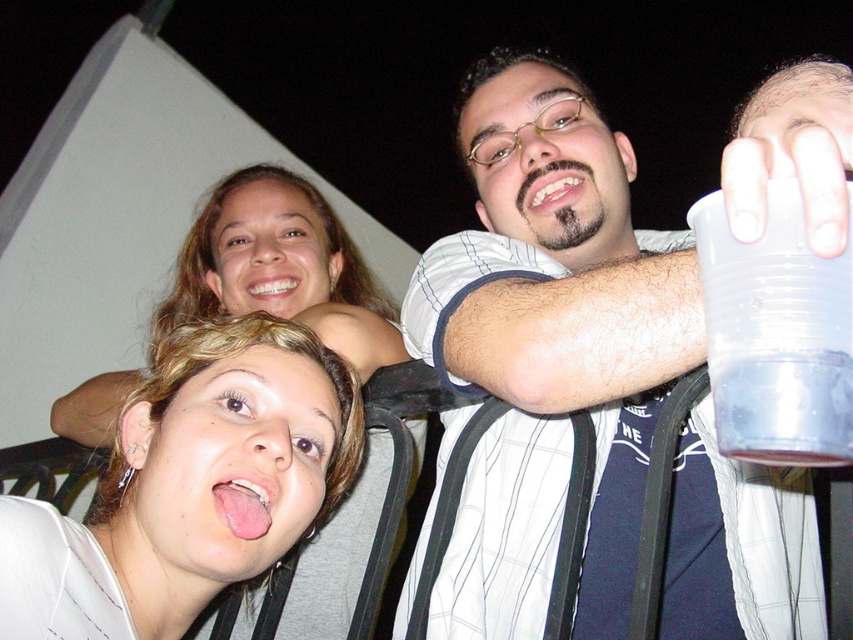
Question: Does smooth skin face at upper center have a smaller size compared to pink flesh tongue at lower center?

Choices:
 (A) yes
 (B) no

Answer: (B)

Question: Among these points, which one is farthest from the camera?

Choices:
 (A) (849, 444)
 (B) (259, 184)
 (C) (498, 474)

Answer: (B)

Question: Which point is farther from the camera taking this photo?

Choices:
 (A) (254, 484)
 (B) (277, 284)

Answer: (B)

Question: Is transparent plastic cup at upper right to the right of pink flesh tongue at lower center from the viewer's perspective?

Choices:
 (A) yes
 (B) no

Answer: (A)

Question: Which object is farther from the camera taking this photo?

Choices:
 (A) pink flesh tongue at lower center
 (B) smooth skin face at upper center

Answer: (B)

Question: Is transparent plastic cup at upper right bigger than pink flesh tongue at lower center?

Choices:
 (A) yes
 (B) no

Answer: (A)